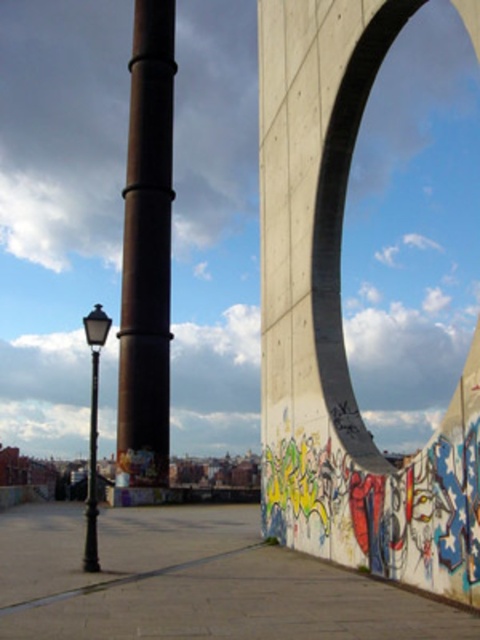
You are standing in front of the large concrete archway with graffiti. There are two points marked in the scene. The first point is at coordinate point (134, 344) and the second point is at coordinate point (358, 456). Which of these points is closer to you?

Point (134, 344) is closer to you because it is further to the camera than point (358, 456).

You are standing in front of the large concrete archway with graffiti and see two points marked in the scene. The first point is at coordinates point [362,426] and the second is at point [101,308]. Which point is closer to you?

Point [362,426] is further to the viewer than point [101,308], so the second point is closer to you.

You are a city planner trying to install a new bench between the rusty metal pole at center and the polished brass streetlamp at lower left. Based on their positions, which object should the bench be closer to?

The bench should be placed closer to the polished brass streetlamp at lower left because the rusty metal pole at center is positioned on the right side of the polished brass streetlamp at lower left, meaning the streetlamp is to the left of the pole. Therefore, the bench should be closer to the streetlamp to maintain symmetry or balance in the urban layout.